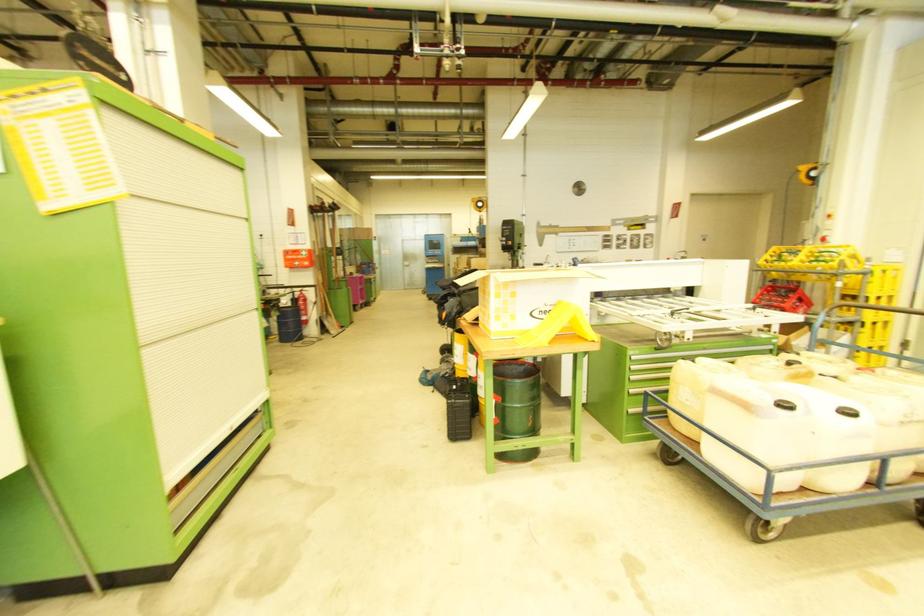
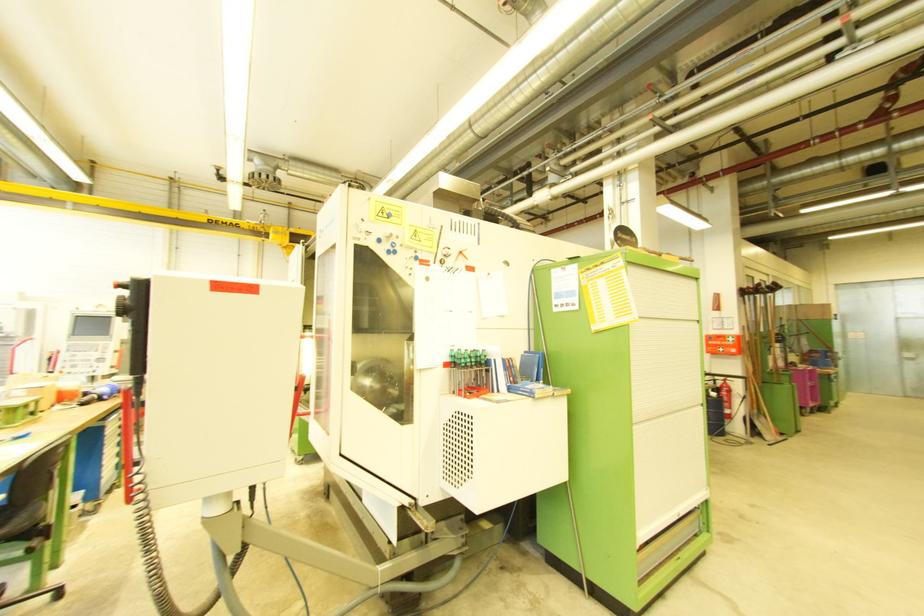
Question: The camera is either moving clockwise (left) or counter-clockwise (right) around the object. The first image is from the beginning of the video and the second image is from the end. Is the camera moving left or right when shooting the video?

Choices:
 (A) Left
 (B) Right

Answer: (B)